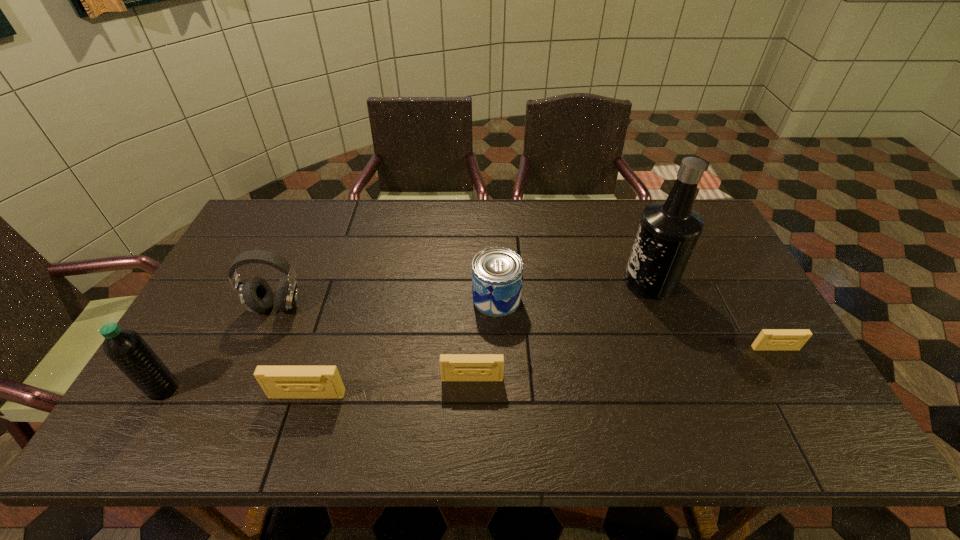
The height and width of the screenshot is (540, 960). Find the location of `vacant space at the far left corner of the desktop`. vacant space at the far left corner of the desktop is located at coordinates (276, 204).

Find the location of `free location at the far right corner of the desktop`. free location at the far right corner of the desktop is located at coordinates (698, 210).

Identify the location of free point between the nearest videotape and the can. (401, 347).

Where is `vacant space that's between the liquor and the water bottle`? vacant space that's between the liquor and the water bottle is located at coordinates (407, 335).

You are a GUI agent. You are given a task and a screenshot of the screen. Output one action in this format:
    pyautogui.click(x=<x>, y=<y>)
    Task: Click on the free spot between the second object from right to left and the fifth shortest object
    
    Given the screenshot: What is the action you would take?
    pos(464,294)

Where is `vacant point located between the second tallest videotape and the second object from right to left`? This screenshot has width=960, height=540. vacant point located between the second tallest videotape and the second object from right to left is located at coordinates (561, 330).

Where is `free point between the rightmost videotape and the fifth shortest object`? This screenshot has width=960, height=540. free point between the rightmost videotape and the fifth shortest object is located at coordinates (526, 327).

You are a GUI agent. You are given a task and a screenshot of the screen. Output one action in this format:
    pyautogui.click(x=<x>, y=<y>)
    Task: Click on the free space that is in between the fourth nearest object and the second shortest videotape
    The height and width of the screenshot is (540, 960).
    Given the screenshot: What is the action you would take?
    pyautogui.click(x=624, y=363)

At what (x,y) coordinates should I click in order to perform the action: click on unoccupied area between the sixth tallest object and the farthest videotape. Please return your answer as a coordinate pair (x, y). The height and width of the screenshot is (540, 960). Looking at the image, I should click on (624, 363).

What are the coordinates of `free space between the fifth shortest object and the fourth shortest object` in the screenshot? It's located at (387, 302).